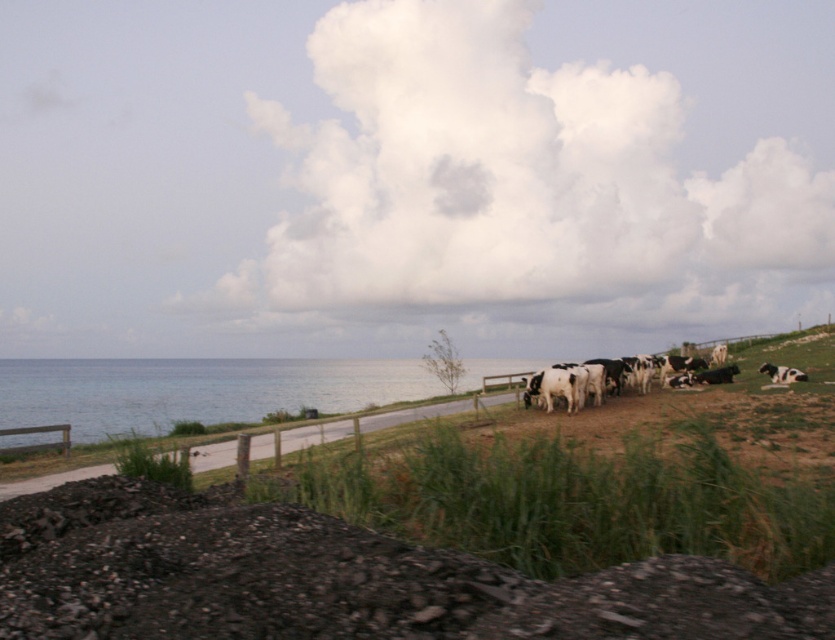
Question: Which point appears closest to the camera in this image?

Choices:
 (A) (292, 490)
 (B) (301, 381)
 (C) (560, 365)
 (D) (44, 486)

Answer: (A)

Question: Which object is positioned closest to the green grass at center?

Choices:
 (A) black and white spotted cow at right
 (B) blue water at lower left

Answer: (A)

Question: Can you confirm if smooth concrete road at lower center is wider than black and white spotted cows at right?

Choices:
 (A) yes
 (B) no

Answer: (B)

Question: Based on their relative distances, which object is nearer to the black and white spotted cows at right?

Choices:
 (A) green grass at center
 (B) blue water at lower left
 (C) black and white spotted cow at right

Answer: (C)

Question: Observing the image, what is the correct spatial positioning of green grass at center in reference to blue water at lower left?

Choices:
 (A) left
 (B) right

Answer: (B)

Question: Does blue water at lower left have a smaller size compared to black and white spotted cow at right?

Choices:
 (A) yes
 (B) no

Answer: (B)